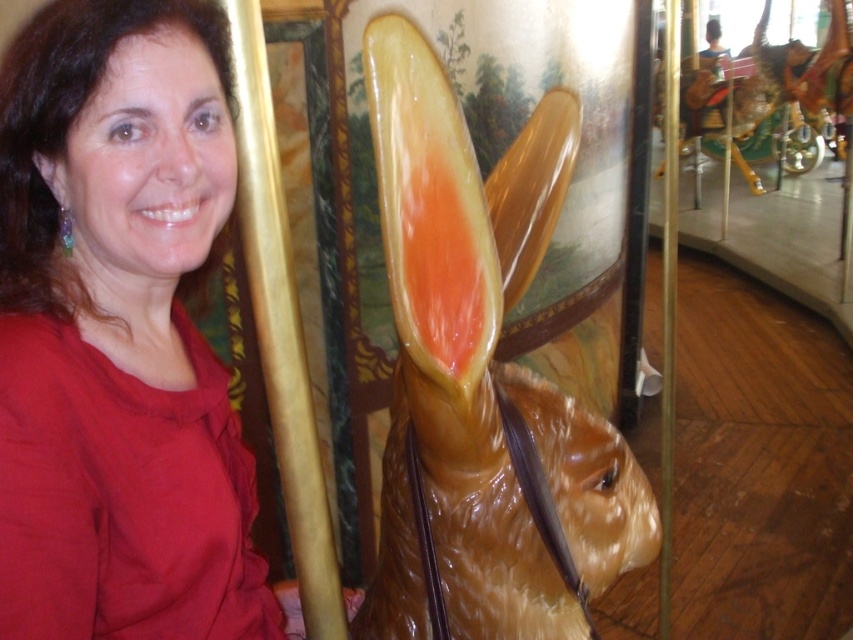
Measure the distance between point (97,12) and camera.

Point (97,12) is 26.09 inches away from camera.

Is matte red blouse at upper left taller than brown glossy rabbit at center?

Incorrect, matte red blouse at upper left's height is not larger of brown glossy rabbit at center's.

Locate an element on the screen. matte red blouse at upper left is located at coordinates pyautogui.click(x=119, y=333).